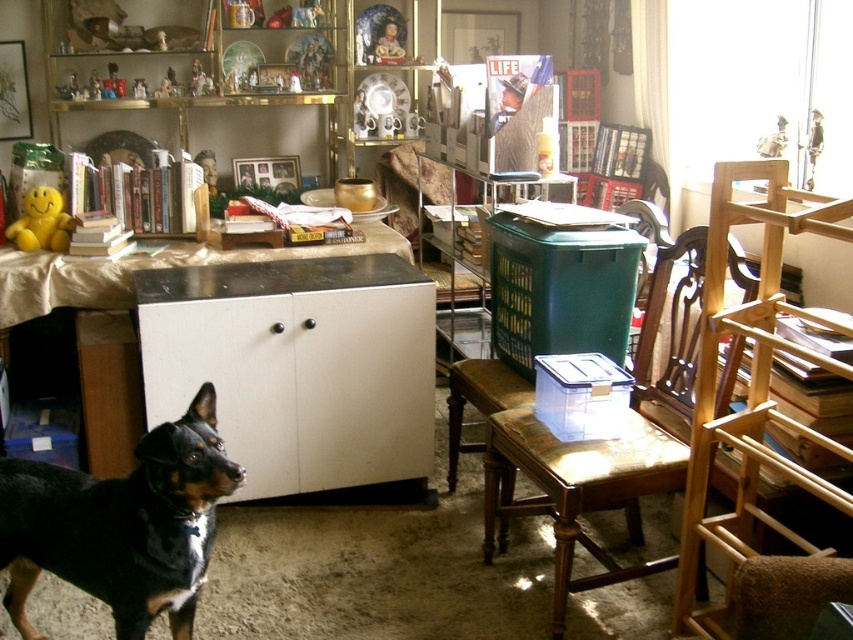
Question: Among these objects, which one is nearest to the camera?

Choices:
 (A) yellow rubber duck at upper left
 (B) wooden chair at right
 (C) green plastic chair at center

Answer: (B)

Question: Which object is the closest to the black glossy dog at lower left?

Choices:
 (A) porcelain figurine at upper center
 (B) wooden chair at center
 (C) matte gold frame at upper center
 (D) white glossy cabinet at center

Answer: (D)

Question: Considering the real-world distances, which object is closest to the black glossy dog at lower left?

Choices:
 (A) green plastic chair at center
 (B) wooden chair at center
 (C) yellow rubber duck at upper left
 (D) matte gold frame at upper center

Answer: (B)

Question: Does wooden chair at right appear under green plastic chair at center?

Choices:
 (A) no
 (B) yes

Answer: (B)

Question: Can you confirm if white glossy cabinet at center is positioned above yellow rubber duck at upper left?

Choices:
 (A) yes
 (B) no

Answer: (B)

Question: Does porcelain figurine at upper center appear over yellow rubber duck at upper left?

Choices:
 (A) no
 (B) yes

Answer: (B)